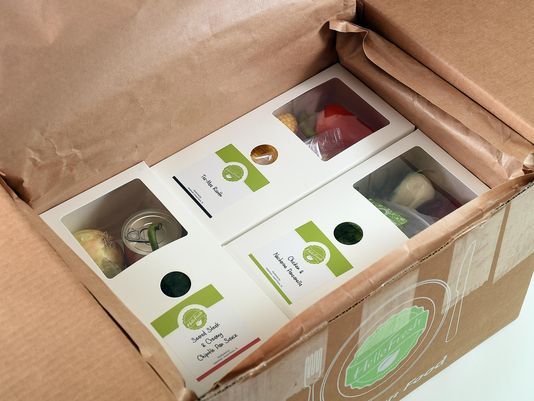
Identify the location of box. (32, 302).